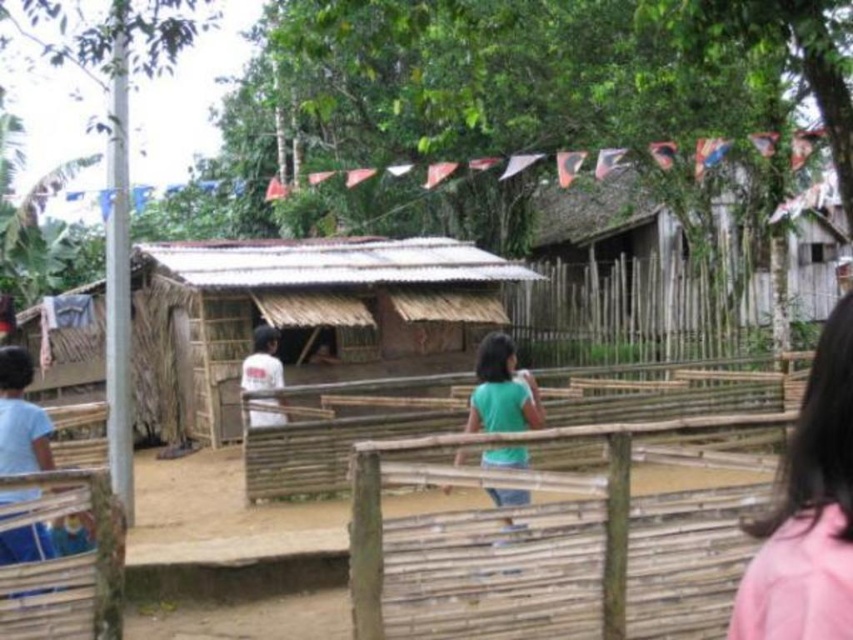
Is rustic wooden hut at upper right taller than green matte shirt at center?

Yes.

Is point (750, 257) positioned in front of point (527, 401)?

That is False.

Which is behind, point (821, 314) or point (492, 490)?

The point (821, 314) is more distant.

The height and width of the screenshot is (640, 853). Find the location of `rustic wooden hut at upper right`. rustic wooden hut at upper right is located at coordinates (645, 292).

The width and height of the screenshot is (853, 640). I want to click on rustic wooden hut at upper right, so click(645, 292).

Where is `rustic wooden hut at upper right`? The height and width of the screenshot is (640, 853). rustic wooden hut at upper right is located at coordinates (645, 292).

Who is more distant from viewer, [657,312] or [49,456]?

Point [657,312]

Based on the photo, does rustic wooden hut at upper right appear over blue cotton shirt at left?

Yes.

Describe the element at coordinates (645, 292) in the screenshot. I see `rustic wooden hut at upper right` at that location.

At what (x,y) coordinates should I click in order to perform the action: click on rustic wooden hut at upper right. Please return your answer as a coordinate pair (x, y). Looking at the image, I should click on (645, 292).